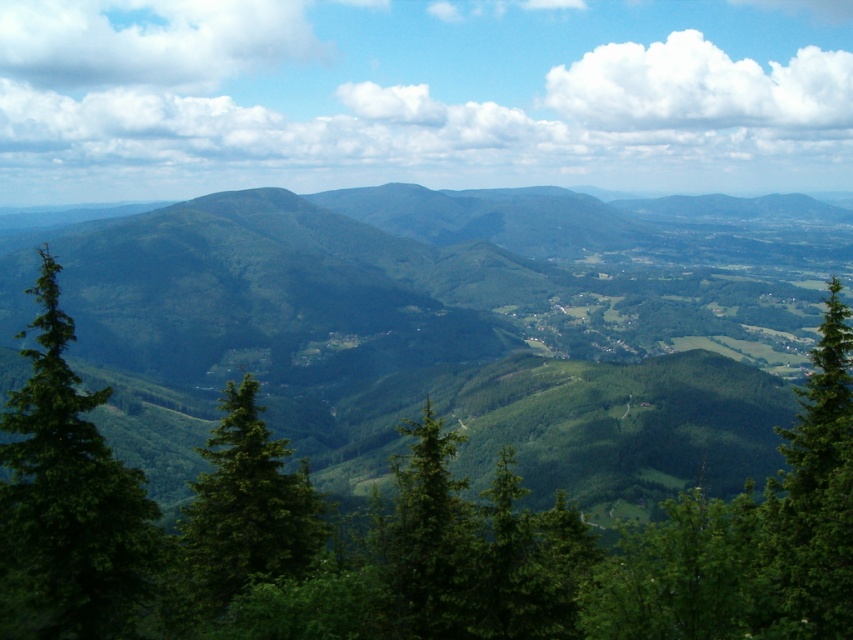
Consider the image. Which of these two, green matte forest at center or green matte tree at left, stands taller?

green matte forest at center

Who is more forward, (723, 428) or (149, 595)?

Positioned in front is point (149, 595).

Measure the distance between green matte forest at center and camera.

They are 32.67 meters apart.

Image resolution: width=853 pixels, height=640 pixels. Find the location of `green matte forest at center`. green matte forest at center is located at coordinates (454, 328).

Can you confirm if green matte forest at center is positioned below green textured tree at right?

No.

The width and height of the screenshot is (853, 640). What do you see at coordinates (454, 328) in the screenshot?
I see `green matte forest at center` at bounding box center [454, 328].

Between point (119, 246) and point (808, 408), which one is positioned behind?

The point (119, 246) is behind.

Where is `green matte forest at center`? This screenshot has width=853, height=640. green matte forest at center is located at coordinates (454, 328).

Measure the distance between green matte tree at left and green leafy tree at center.

green matte tree at left and green leafy tree at center are 4.17 meters apart from each other.

Which is behind, point (4, 529) or point (218, 528)?

The point (218, 528) is more distant.

Locate an element on the screen. The height and width of the screenshot is (640, 853). green matte tree at left is located at coordinates (67, 500).